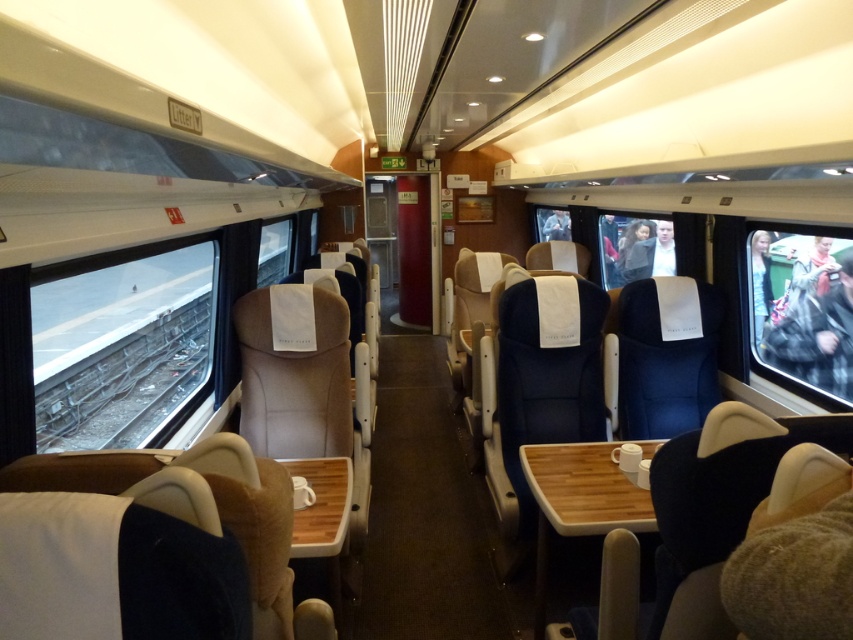
Can you confirm if transparent plastic window at right is thinner than light blue fabric jacket at center?

In fact, transparent plastic window at right might be wider than light blue fabric jacket at center.

Who is higher up, transparent plastic window at right or light blue fabric jacket at center?

light blue fabric jacket at center is higher up.

Does point (811, 259) come in front of point (637, 234)?

Yes.

Find the location of `transparent plastic window at right`. transparent plastic window at right is located at coordinates (802, 307).

Between dark gray metal train track at left and clear glass window at center, which one appears on the left side from the viewer's perspective?

From the viewer's perspective, dark gray metal train track at left appears more on the left side.

Is point (97, 374) in front of point (666, 252)?

Yes, it is.

Is point (129, 371) in front of point (648, 228)?

That is True.

Where is `dark gray metal train track at left`? This screenshot has width=853, height=640. dark gray metal train track at left is located at coordinates (126, 384).

Which of these two, transparent plastic window at right or clear glass window at center, stands taller?

transparent plastic window at right

Between transparent plastic window at right and clear glass window at center, which one has less height?

clear glass window at center is shorter.

Who is more distant from viewer, (851, 396) or (635, 275)?

Point (635, 275)

What are the coordinates of `transparent plastic window at right` in the screenshot? It's located at (802, 307).